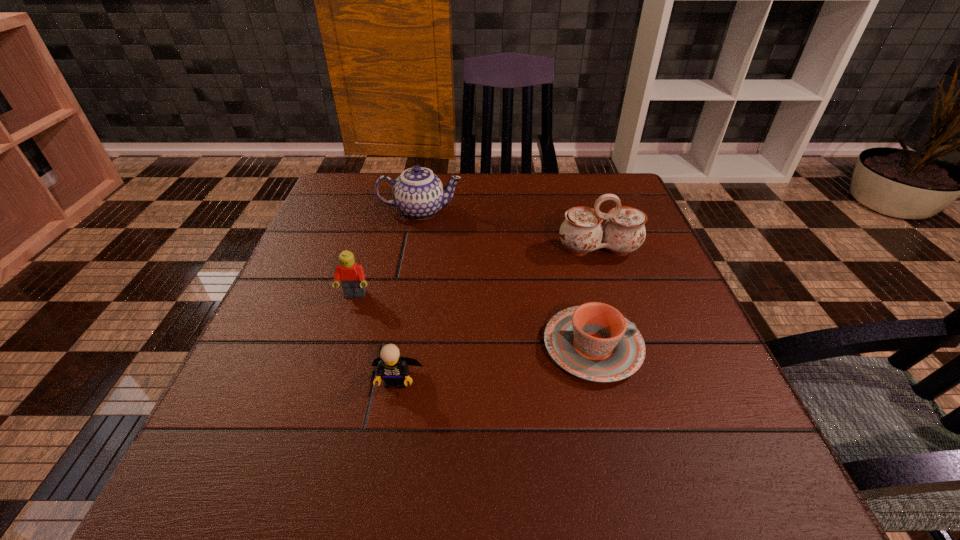
I want to click on vacant point that satisfies the following two spatial constraints: 1. by the handle of the second farthest chinaware; 2. on the handle side of the shortest object, so click(631, 346).

At what (x,y) coordinates should I click in order to perform the action: click on free spot that satisfies the following two spatial constraints: 1. from the spout of the leftmost chinaware; 2. on the face of the third tallest object. Please return your answer as a coordinate pair (x, y). This screenshot has height=540, width=960. Looking at the image, I should click on pyautogui.click(x=405, y=295).